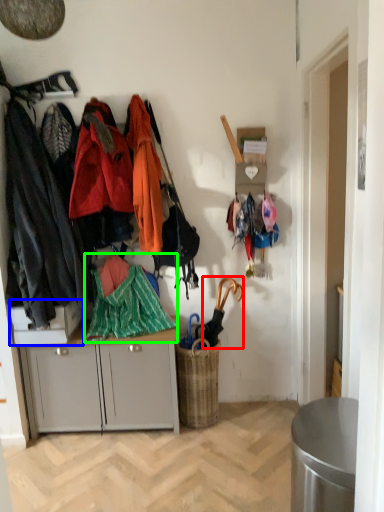
Question: Considering the real-world distances, which object is closest to umbrella (highlighted by a red box)? desk (highlighted by a blue box) or jacket (highlighted by a green box).

Choices:
 (A) desk
 (B) jacket

Answer: (B)